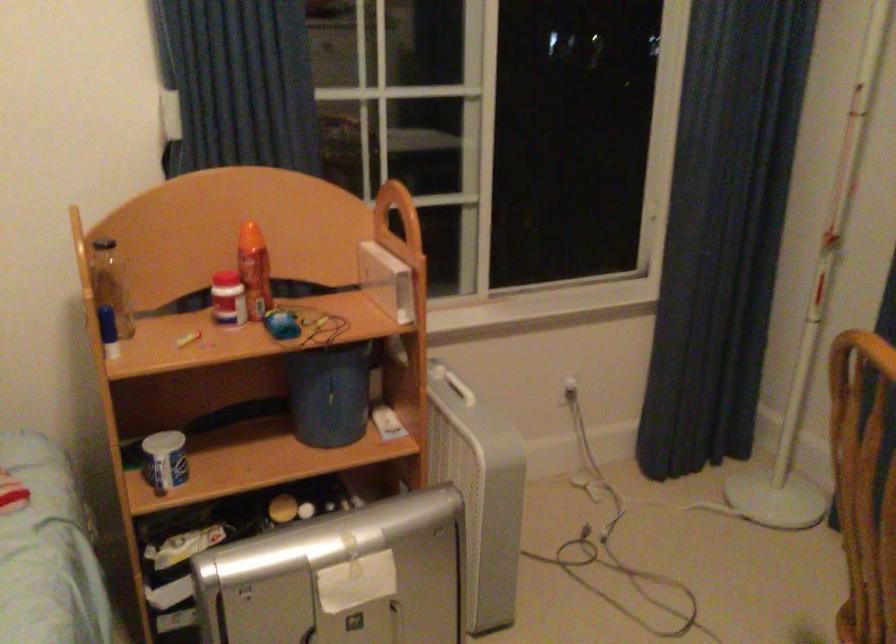
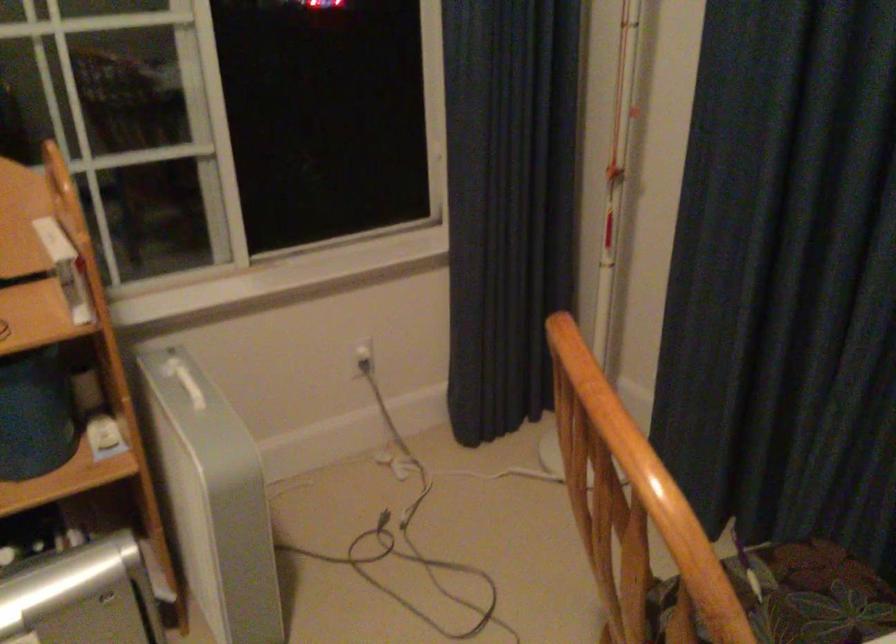
Question: The first image is from the beginning of the video and the second image is from the end. How did the camera likely rotate when shooting the video?

Choices:
 (A) Left
 (B) Right
 (C) Up
 (D) Down

Answer: (B)